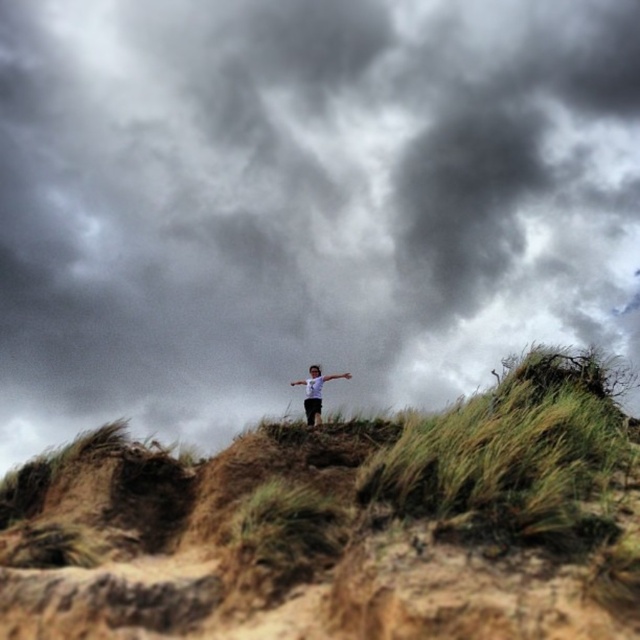
Question: Observing the image, what is the correct spatial positioning of dark gray cloud at upper center in reference to brown grassy hillside at center?

Choices:
 (A) above
 (B) below

Answer: (A)

Question: Which point is closer to the camera taking this photo?

Choices:
 (A) (323, 134)
 (B) (307, 419)
 (C) (508, 556)

Answer: (C)

Question: Is dark gray cloud at upper center thinner than brown grassy hillside at center?

Choices:
 (A) no
 (B) yes

Answer: (A)

Question: Among these objects, which one is nearest to the camera?

Choices:
 (A) dark gray cloud at upper center
 (B) white matte shirt at center
 (C) brown grassy hillside at center

Answer: (A)

Question: Can you confirm if brown grassy hillside at center is smaller than white matte shirt at center?

Choices:
 (A) no
 (B) yes

Answer: (B)

Question: Which of the following is the farthest from the observer?

Choices:
 (A) (602, 202)
 (B) (320, 397)

Answer: (B)